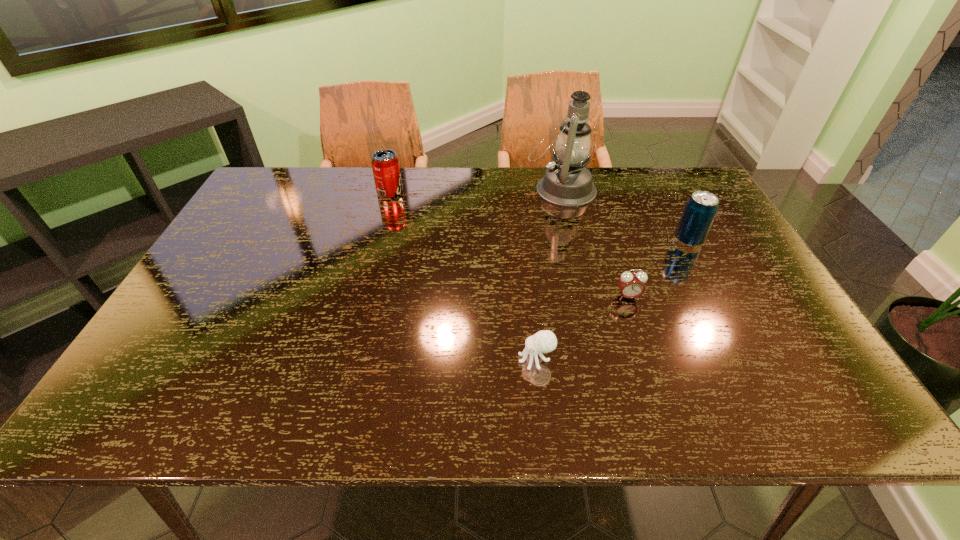
Locate an element on the screen. Image resolution: width=960 pixels, height=540 pixels. free spot between the alarm clock and the nearest object is located at coordinates (582, 328).

The width and height of the screenshot is (960, 540). Identify the location of blank region between the farther soda can and the oil lamp. (475, 191).

This screenshot has width=960, height=540. In order to click on object that is the closest to the oil lamp in this screenshot , I will do `click(701, 208)`.

This screenshot has width=960, height=540. I want to click on object that is the second nearest to the nearest object, so click(x=701, y=208).

Where is `free space that satisfies the following two spatial constraints: 1. on the front side of the oil lamp; 2. on the left side of the nearer soda can`? free space that satisfies the following two spatial constraints: 1. on the front side of the oil lamp; 2. on the left side of the nearer soda can is located at coordinates [x=573, y=240].

What are the coordinates of `free space that satisfies the following two spatial constraints: 1. on the front side of the right soda can; 2. on the front-facing side of the nearest object` in the screenshot? It's located at (752, 359).

Where is `vacant space that satisfies the following two spatial constraints: 1. on the front side of the leftmost object; 2. on the right side of the nearer soda can`? This screenshot has width=960, height=540. vacant space that satisfies the following two spatial constraints: 1. on the front side of the leftmost object; 2. on the right side of the nearer soda can is located at coordinates (377, 240).

This screenshot has height=540, width=960. In order to click on free spot that satisfies the following two spatial constraints: 1. on the clock face of the second nearest object; 2. on the front-facing side of the nearest object in this screenshot , I will do `click(649, 359)`.

This screenshot has height=540, width=960. I want to click on vacant area in the image that satisfies the following two spatial constraints: 1. on the front side of the nearer soda can; 2. on the left side of the farther soda can, so click(377, 240).

At what (x,y) coordinates should I click in order to perform the action: click on blank area in the image that satisfies the following two spatial constraints: 1. on the front side of the leftmost object; 2. on the right side of the rightmost object. Please return your answer as a coordinate pair (x, y). Looking at the image, I should click on (377, 240).